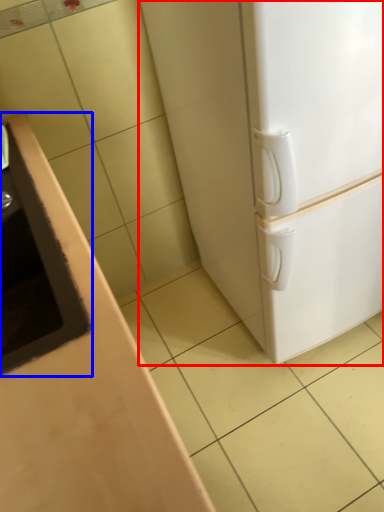
Question: Which point is closer to the camera, refrigerator (highlighted by a red box) or sink (highlighted by a blue box)?

Choices:
 (A) refrigerator
 (B) sink

Answer: (B)